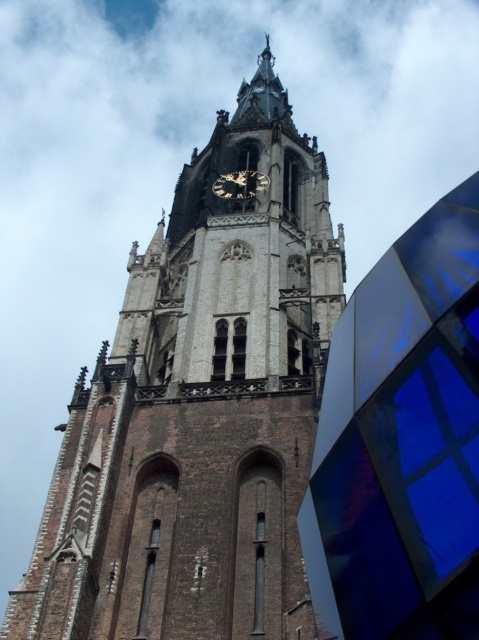
Who is more forward, [213,298] or [249,188]?

Point [213,298] is more forward.

Does point (238, 458) come behind point (252, 172)?

No, it is in front of (252, 172).

Who is more distant from viewer, [239,108] or [228,176]?

The point [239,108] is behind.

Find the location of a particular element. brown brick tower at center is located at coordinates (200, 410).